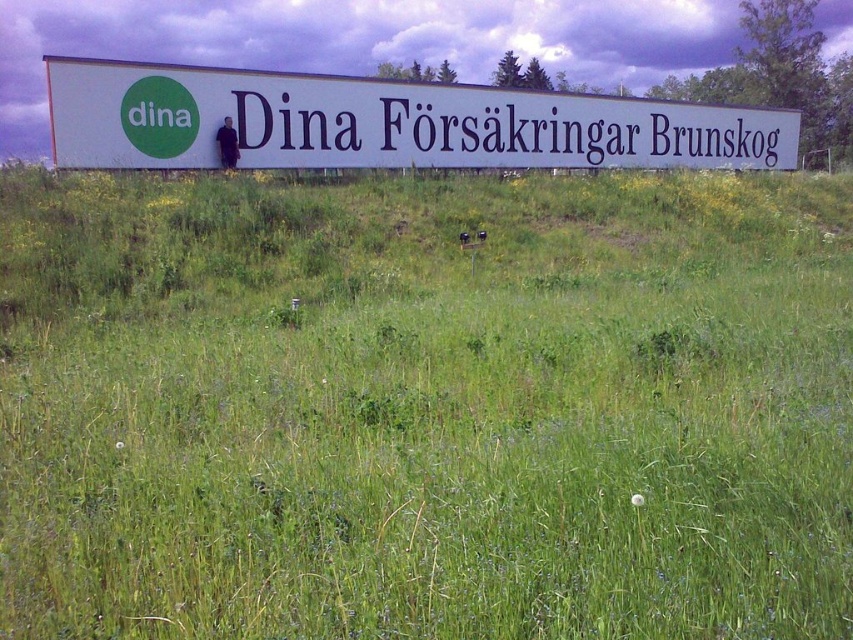
Question: Does green grass at center come in front of white matte sign at center?

Choices:
 (A) yes
 (B) no

Answer: (A)

Question: Which point is closer to the camera?

Choices:
 (A) (666, 116)
 (B) (222, 404)
 (C) (469, 248)

Answer: (B)

Question: Is white matte sign at center above white plastic sign at center?

Choices:
 (A) yes
 (B) no

Answer: (A)

Question: Which point is closer to the camera taking this photo?

Choices:
 (A) (340, 328)
 (B) (68, 124)

Answer: (A)

Question: Can you confirm if green grass at center is smaller than white matte sign at center?

Choices:
 (A) yes
 (B) no

Answer: (A)

Question: Estimate the real-world distances between objects in this image. Which object is closer to the white plastic sign at center?

Choices:
 (A) green grass at center
 (B) white matte sign at center

Answer: (A)